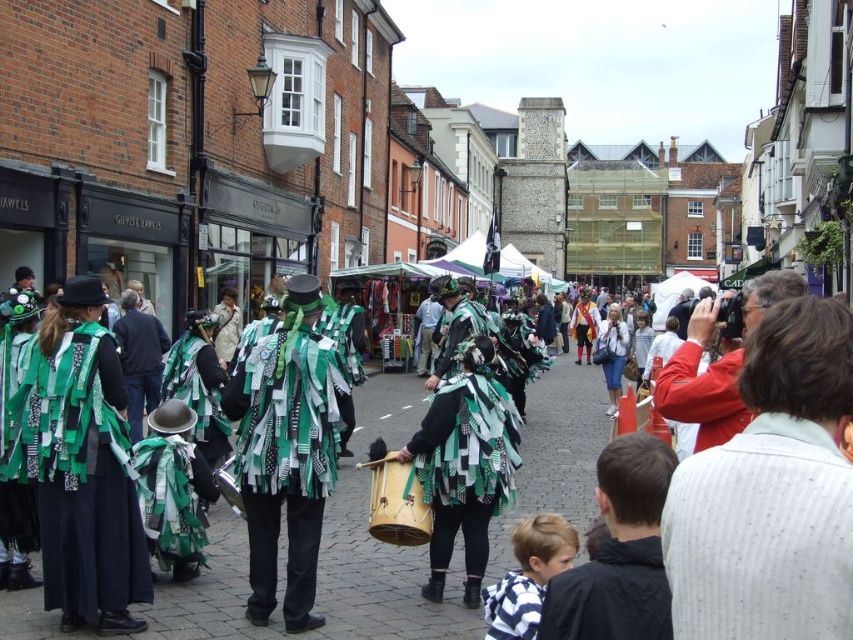
Question: Does red jacket at right appear on the left side of red cotton jacket at right?

Choices:
 (A) no
 (B) yes

Answer: (B)

Question: In this image, where is red jacket at right located relative to wooden drum at center?

Choices:
 (A) above
 (B) below

Answer: (A)

Question: Among these points, which one is farthest from the camera?

Choices:
 (A) 375,460
 (B) 793,618
 (C) 672,408

Answer: (A)

Question: Among these points, which one is nearest to the camera?

Choices:
 (A) (759, 433)
 (B) (405, 509)
 (C) (688, 392)
 (D) (242, 582)

Answer: (A)

Question: Which object is closer to the camera taking this photo?

Choices:
 (A) red jacket at right
 (B) green fabric costumes at center
 (C) wooden drum at center
 (D) red cotton jacket at right

Answer: (A)

Question: Where is red jacket at right located in relation to wooden drum at center in the image?

Choices:
 (A) right
 (B) left

Answer: (A)